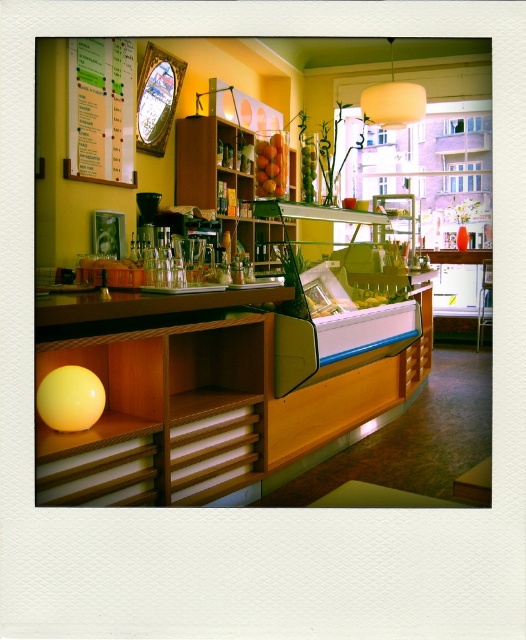
You are a barista who needs to place a new menu that is 1 meter wide on the counter. The matte black coffee machine at center is currently occupying space. Can the white paper at upper left, which is where you plan to place the menu, accommodate the 1 meter wide menu without overlapping the coffee machine?

The matte black coffee machine at center is narrower than the white paper at upper left, so the white paper at upper left has enough space to place the 1 meter wide menu without overlapping the coffee machine.

You are a barista working at the counter and need to place a new coffee machine that is 15 cm thick. The current matte black coffee machine at center is in the way. Can the new machine fit in the space where the matte white lampshade at upper center is currently located?

The matte black coffee machine at center is thinner than the matte white lampshade at upper center. Since the new machine is 15 cm thick, we need to know the thickness of the matte white lampshade at upper center to determine if it can fit. However, the provided information only states the relative thickness between the two objects, not their exact measurements. Therefore, it is unclear if the new machine will fit without additional data.